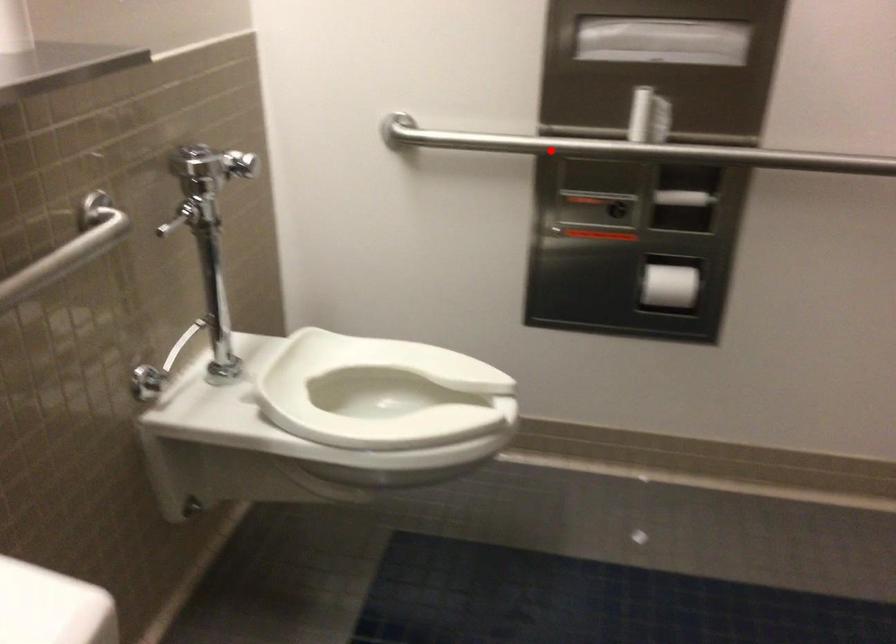
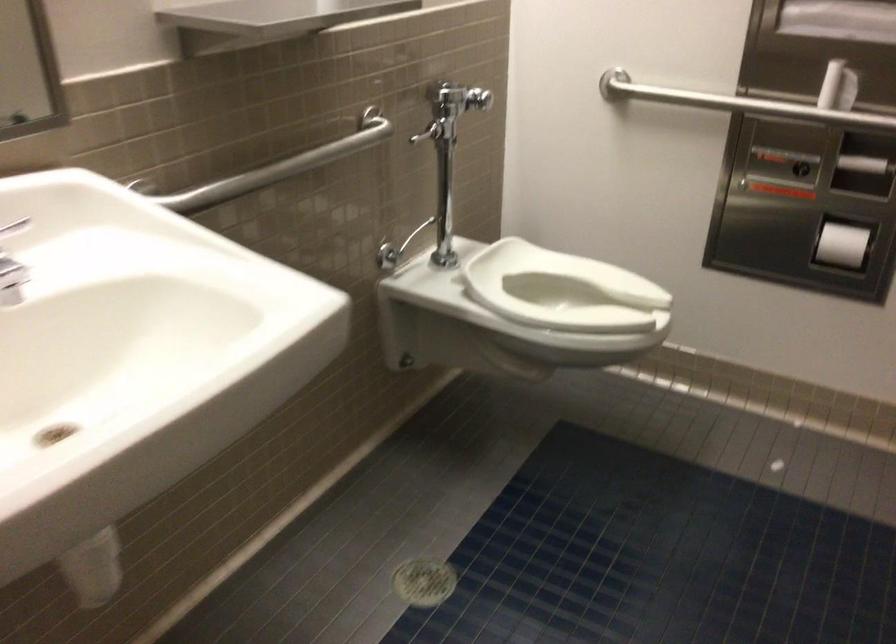
Question: I am providing you with two images of the same scene from different viewpoints. Given a red point in image1, look at the same physical point in image2. Is it:

Choices:
 (A) Closer to the viewpoint
 (B) Farther from the viewpoint

Answer: (B)